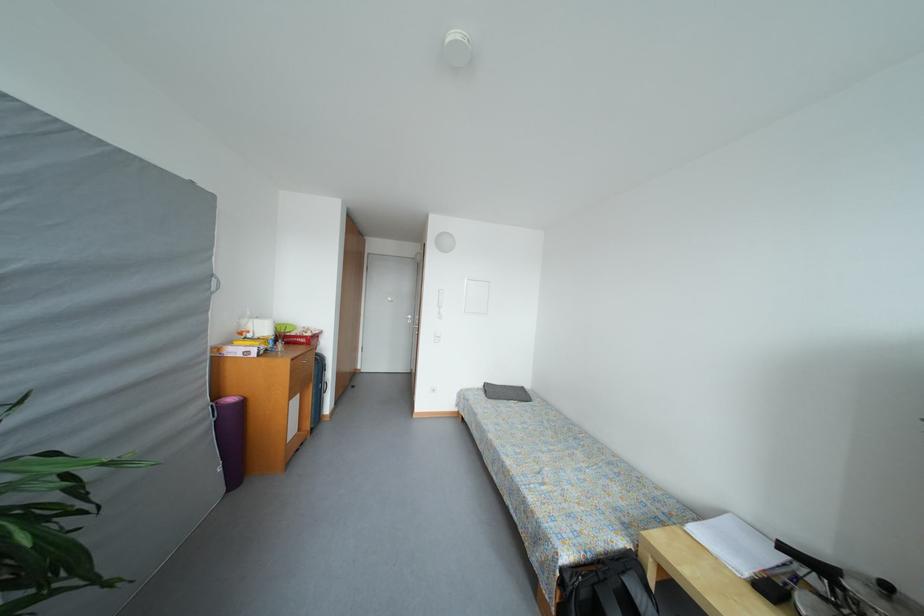
Where is `wardrobe door handle`? wardrobe door handle is located at coordinates (440, 302).